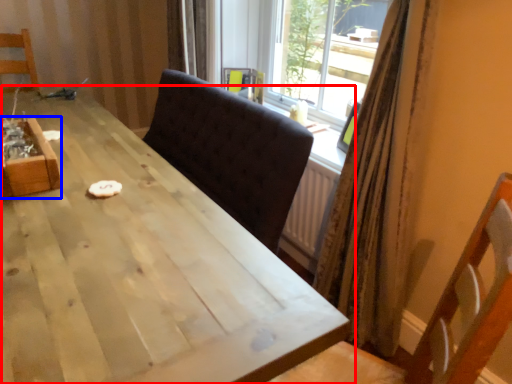
Question: Which object appears farthest to the camera in this image, table (highlighted by a red box) or crate (highlighted by a blue box)?

Choices:
 (A) table
 (B) crate

Answer: (B)